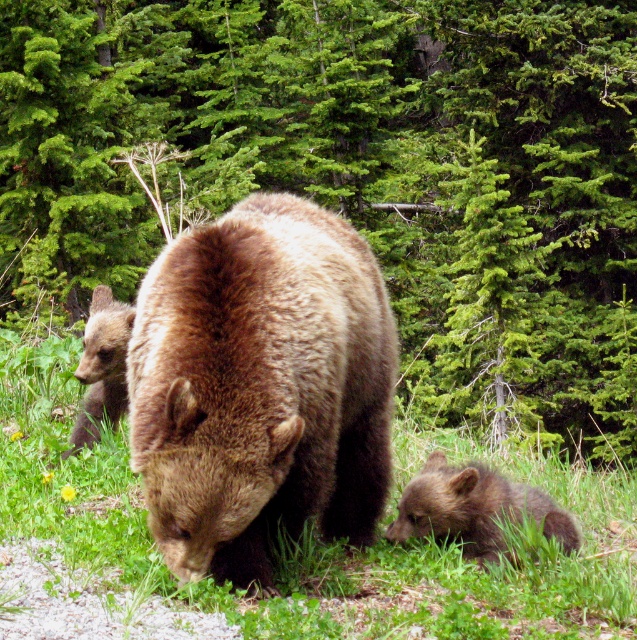
Does brown furry bear at center have a greater height compared to brown fuzzy bear cub at left?

Yes, brown furry bear at center is taller than brown fuzzy bear cub at left.

Is brown furry bear at center below brown fuzzy bear cub at left?

No.

Image resolution: width=637 pixels, height=640 pixels. I want to click on brown furry bear at center, so click(x=261, y=387).

Locate an element on the screen. This screenshot has height=640, width=637. brown furry bear at center is located at coordinates (261, 387).

Based on the photo, can you confirm if green evergreen tree at center is positioned above brown fuzzy bear cub at left?

Indeed, green evergreen tree at center is positioned over brown fuzzy bear cub at left.

Is green evergreen tree at center thinner than brown fuzzy bear cub at left?

In fact, green evergreen tree at center might be wider than brown fuzzy bear cub at left.

Locate an element on the screen. green evergreen tree at center is located at coordinates (354, 176).

Is point (364, 52) farther from viewer compared to point (201, 464)?

Yes.

Can you confirm if green evergreen tree at center is thinner than brown furry bear at center?

No, green evergreen tree at center is not thinner than brown furry bear at center.

I want to click on green evergreen tree at center, so click(354, 176).